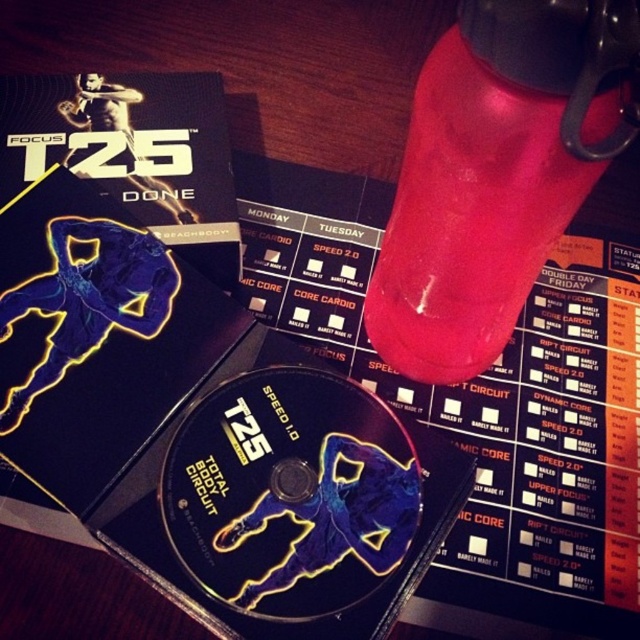
Does red matte water bottle at upper right have a smaller size compared to shiny black cd at center?

Incorrect, red matte water bottle at upper right is not smaller in size than shiny black cd at center.

Does red matte water bottle at upper right appear on the left side of shiny black cd at center?

No, red matte water bottle at upper right is not to the left of shiny black cd at center.

Is point (556, 168) positioned before point (244, 532)?

Yes, it is.

This screenshot has height=640, width=640. In order to click on red matte water bottle at upper right in this screenshot , I will do `click(497, 172)`.